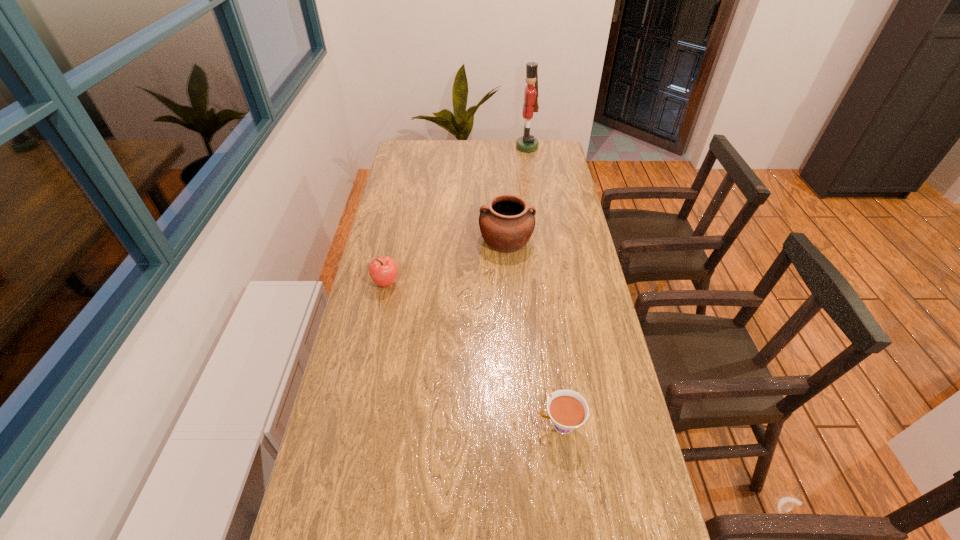
Locate an element on the screen. Image resolution: width=960 pixels, height=540 pixels. the farthest object is located at coordinates (527, 143).

Find the location of `the tallest object`. the tallest object is located at coordinates (527, 143).

This screenshot has width=960, height=540. Find the location of `the second farthest object`. the second farthest object is located at coordinates (506, 222).

I want to click on pottery, so click(506, 222).

At what (x,y) coordinates should I click in order to perform the action: click on the leftmost object. Please return your answer as a coordinate pair (x, y). The image size is (960, 540). Looking at the image, I should click on (383, 270).

The image size is (960, 540). I want to click on the second shortest object, so (x=383, y=270).

Image resolution: width=960 pixels, height=540 pixels. What are the coordinates of `the nearest object` in the screenshot? It's located at (567, 409).

Where is `teacup`? teacup is located at coordinates (567, 409).

Where is `vacant space located on the front-facing side of the tallest object`? This screenshot has height=540, width=960. vacant space located on the front-facing side of the tallest object is located at coordinates (491, 147).

Find the location of a particular element. Image resolution: width=960 pixels, height=540 pixels. free spot located on the front-facing side of the tallest object is located at coordinates (440, 147).